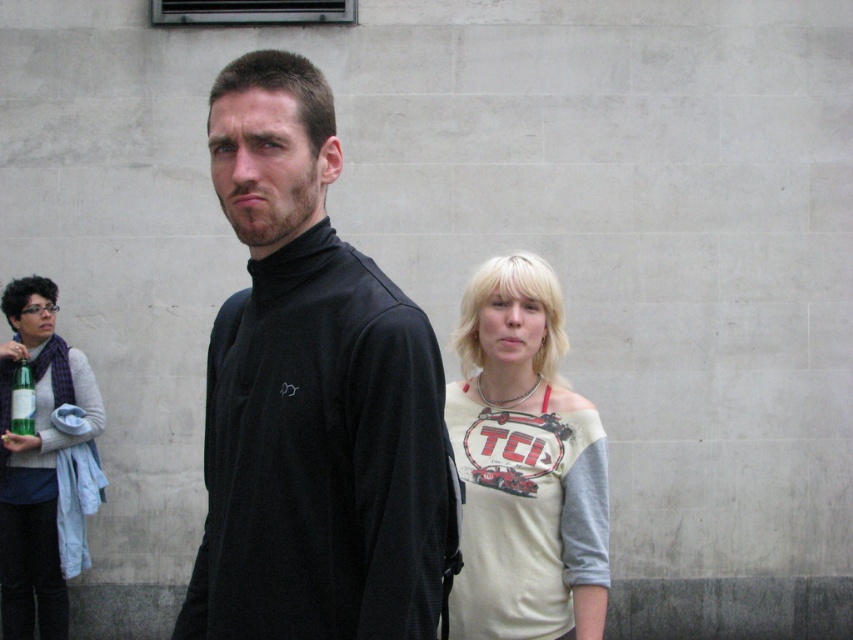
Which is in front, point (595, 541) or point (32, 397)?

Point (595, 541) is more forward.

What do you see at coordinates (524, 465) in the screenshot?
I see `white matte shirt at center` at bounding box center [524, 465].

Is point (578, 592) behind point (15, 428)?

No.

Find the location of `white matte shirt at center`. white matte shirt at center is located at coordinates (524, 465).

Between matte gray sweater at left and green glass bottle at left, which one has less height?

With less height is green glass bottle at left.

Is point (39, 554) farther from viewer compared to point (26, 372)?

Yes, it is behind point (26, 372).

Measure the distance between point (26, 561) and camera.

Point (26, 561) is 7.11 meters away from camera.

The height and width of the screenshot is (640, 853). I want to click on matte gray sweater at left, so click(44, 465).

Who is shorter, black matte turtleneck at center or matte gray sweater at left?

black matte turtleneck at center

Between black matte turtleneck at center and matte gray sweater at left, which one is positioned higher?

black matte turtleneck at center

Does point (315, 564) come farther from viewer compared to point (57, 632)?

No, it is not.

Where is `black matte turtleneck at center`? The height and width of the screenshot is (640, 853). black matte turtleneck at center is located at coordinates (312, 397).